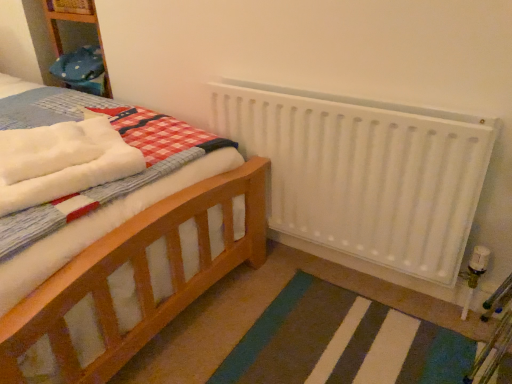
Find the location of `white matte radiator at upper right`. white matte radiator at upper right is located at coordinates (364, 172).

What do you see at coordinates (364, 172) in the screenshot? The width and height of the screenshot is (512, 384). I see `white matte radiator at upper right` at bounding box center [364, 172].

This screenshot has width=512, height=384. I want to click on white fluffy bath towel at left, so click(x=61, y=161).

This screenshot has width=512, height=384. Describe the element at coordinates (61, 161) in the screenshot. I see `white fluffy bath towel at left` at that location.

Identify the location of white matte radiator at upper right. (364, 172).

Considering the positions of objects white fluffy bath towel at left and white matte radiator at upper right in the image provided, who is more to the right, white fluffy bath towel at left or white matte radiator at upper right?

Positioned to the right is white matte radiator at upper right.

Does white fluffy bath towel at left come in front of white matte radiator at upper right?

Yes, white fluffy bath towel at left is closer to the viewer.

Does point (1, 183) come closer to viewer compared to point (303, 228)?

Yes, it is.

In the scene shown: From the image's perspective, is white fluffy bath towel at left located above or below white matte radiator at upper right?

Based on their image positions, white fluffy bath towel at left is located above white matte radiator at upper right.

From a real-world perspective, who is located lower, white fluffy bath towel at left or white matte radiator at upper right?

From a 3D spatial view, white matte radiator at upper right is below.

Can you confirm if white fluffy bath towel at left is thinner than white matte radiator at upper right?

Incorrect, the width of white fluffy bath towel at left is not less than that of white matte radiator at upper right.

Between white fluffy bath towel at left and white matte radiator at upper right, which one has more height?

white matte radiator at upper right is taller.

Looking at the image, does white fluffy bath towel at left seem bigger or smaller compared to white matte radiator at upper right?

In the image, white fluffy bath towel at left appears to be smaller than white matte radiator at upper right.

Is white fluffy bath towel at left not inside white matte radiator at upper right?

white fluffy bath towel at left lies outside white matte radiator at upper right's area.

Is there a large distance between white fluffy bath towel at left and white matte radiator at upper right?

No, white fluffy bath towel at left is in close proximity to white matte radiator at upper right.

Based on the photo, is white fluffy bath towel at left turned away from white matte radiator at upper right?

No.

What's the angular difference between white fluffy bath towel at left and white matte radiator at upper right's facing directions?

white fluffy bath towel at left and white matte radiator at upper right are facing 69.4 degrees away from each other.

Identify the location of bath towel above the white matte radiator at upper right (from a real-world perspective). (61, 161).

Looking at this image, which is more to the right, white matte radiator at upper right or white fluffy bath towel at left?

white matte radiator at upper right.

Is the position of white matte radiator at upper right more distant than that of white fluffy bath towel at left?

Yes, white matte radiator at upper right is behind white fluffy bath towel at left.

Is point (453, 212) in front of point (19, 174)?

No, (453, 212) is further to viewer.

From the image's perspective, between white matte radiator at upper right and white fluffy bath towel at left, who is located below?

white matte radiator at upper right.

From a real-world perspective, is white matte radiator at upper right located higher than white fluffy bath towel at left?

No.

In terms of width, does white matte radiator at upper right look wider or thinner when compared to white fluffy bath towel at left?

Considering their sizes, white matte radiator at upper right looks slimmer than white fluffy bath towel at left.

From their relative heights in the image, would you say white matte radiator at upper right is taller or shorter than white fluffy bath towel at left?

In the image, white matte radiator at upper right appears to be taller than white fluffy bath towel at left.

Looking at this image, considering the relative sizes of white matte radiator at upper right and white fluffy bath towel at left in the image provided, is white matte radiator at upper right smaller than white fluffy bath towel at left?

Incorrect, white matte radiator at upper right is not smaller in size than white fluffy bath towel at left.

Is white matte radiator at upper right not inside white fluffy bath towel at left?

Yes.

Are white matte radiator at upper right and white fluffy bath towel at left far apart?

No.

Is white matte radiator at upper right facing towards white fluffy bath towel at left?

Yes, white matte radiator at upper right is turned towards white fluffy bath towel at left.

What's the angular difference between white matte radiator at upper right and white fluffy bath towel at left's facing directions?

They differ by 69.4 degrees in their facing directions.

From the picture: Measure the distance from white matte radiator at upper right to white fluffy bath towel at left.

white matte radiator at upper right and white fluffy bath towel at left are 24.16 inches apart from each other.

The image size is (512, 384). Find the location of `radiator behind the white fluffy bath towel at left`. radiator behind the white fluffy bath towel at left is located at coordinates (364, 172).

In the image, there is a white fluffy bath towel at left. Where is `radiator below it (from the image's perspective)`? The height and width of the screenshot is (384, 512). radiator below it (from the image's perspective) is located at coordinates (364, 172).

The width and height of the screenshot is (512, 384). In order to click on radiator that is under the white fluffy bath towel at left (from a real-world perspective) in this screenshot , I will do `click(364, 172)`.